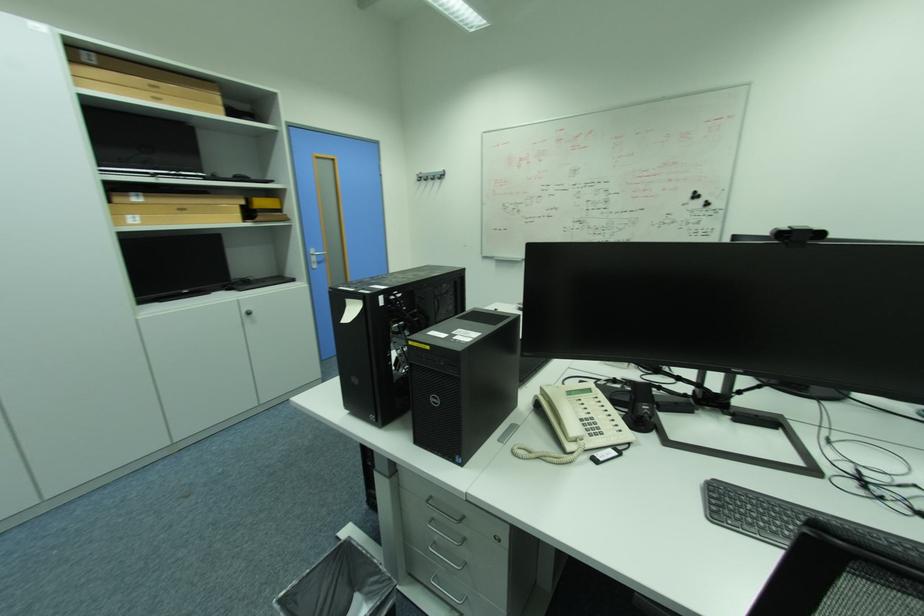
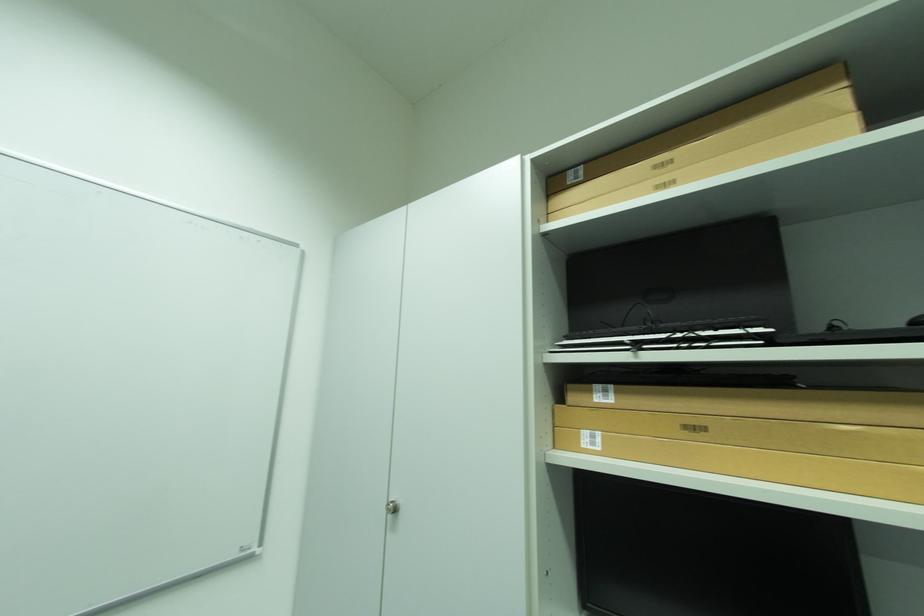
In the second image, find the point that corresponds to pixel 136 217 in the first image.

(593, 434)